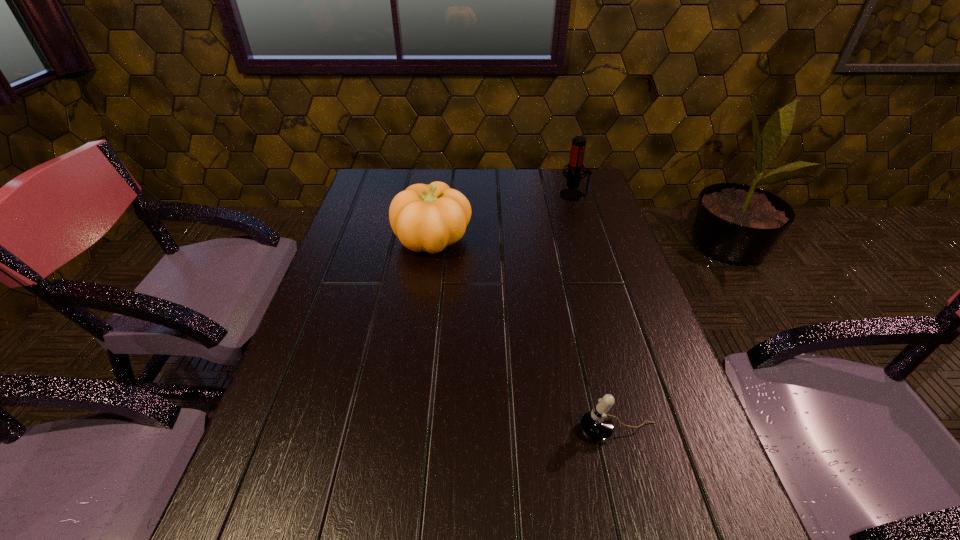
Locate an element on the screen. The height and width of the screenshot is (540, 960). object that is at the left edge is located at coordinates (429, 218).

This screenshot has width=960, height=540. I want to click on object positioned at the far right corner, so click(575, 166).

I want to click on free space at the far edge, so click(497, 202).

In the image, there is a desktop. Where is `vacant space at the left edge`? vacant space at the left edge is located at coordinates (357, 237).

At what (x,y) coordinates should I click in order to perform the action: click on free region at the right edge. Please return your answer as a coordinate pair (x, y). The width and height of the screenshot is (960, 540). Looking at the image, I should click on (x=643, y=288).

Identify the location of vacant space at the far left corner of the desktop. (359, 191).

Locate an element on the screen. The width and height of the screenshot is (960, 540). empty space that is in between the nearest object and the pumpkin is located at coordinates (525, 335).

This screenshot has width=960, height=540. Find the location of `free space between the farther microphone and the shorter microphone`. free space between the farther microphone and the shorter microphone is located at coordinates (596, 313).

At what (x,y) coordinates should I click in order to perform the action: click on vacant region between the shortest object and the second farthest object. Please return your answer as a coordinate pair (x, y). Image resolution: width=960 pixels, height=540 pixels. Looking at the image, I should click on (525, 335).

In order to click on free space between the taller microphone and the second nearest object in this screenshot , I will do `click(503, 217)`.